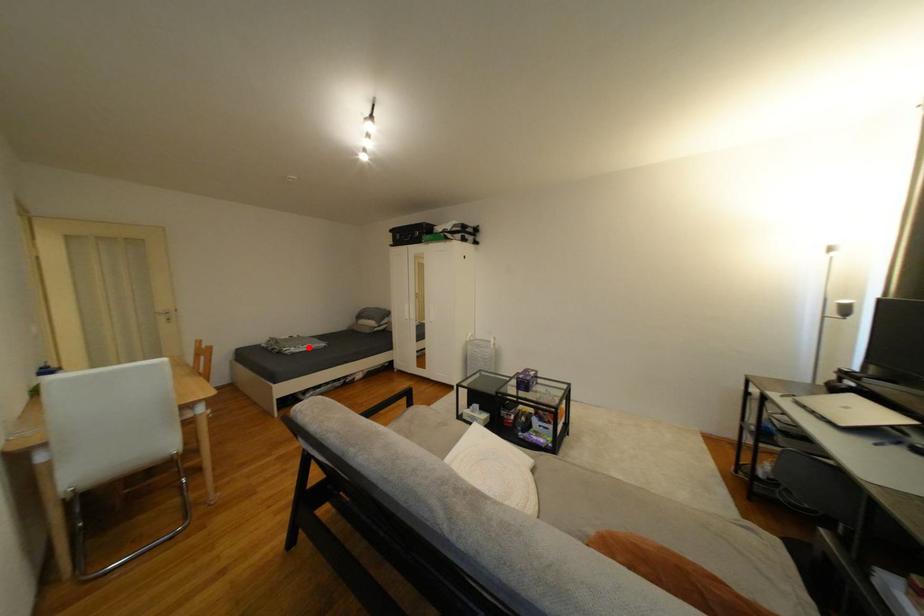
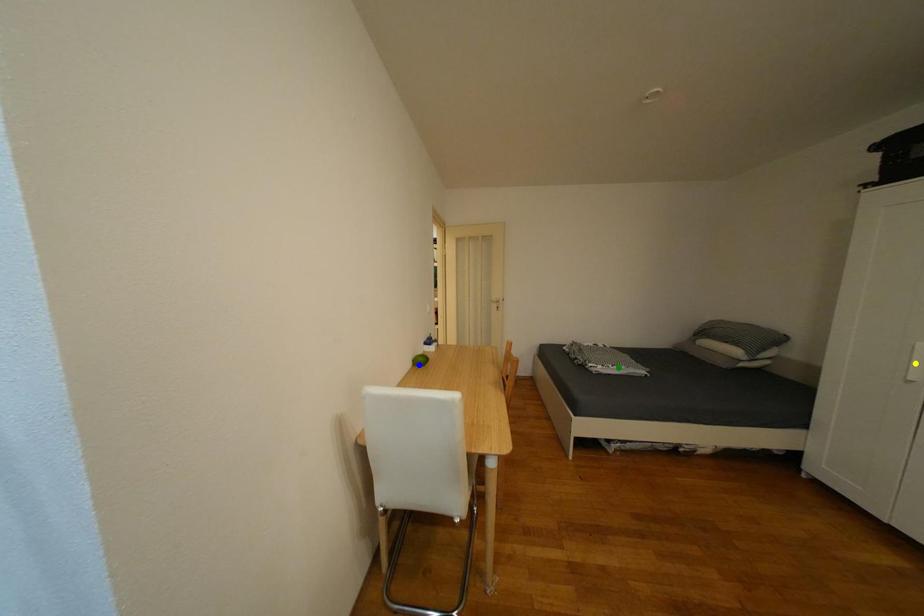
Question: I am providing you with two images of the same scene from different viewpoints. A red point is marked on the first image. You are given multiple points on the second image. Can you choose the point in image 2 that corresponds to the point in image 1?

Choices:
 (A) yellow point
 (B) green point
 (C) blue point

Answer: (B)